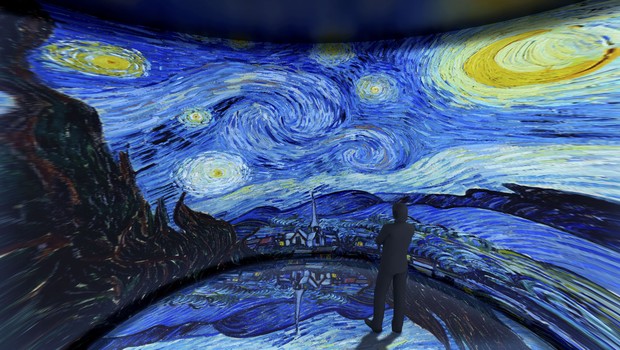
The width and height of the screenshot is (620, 350). What are the coordinates of `painting` in the screenshot? It's located at (372, 122).